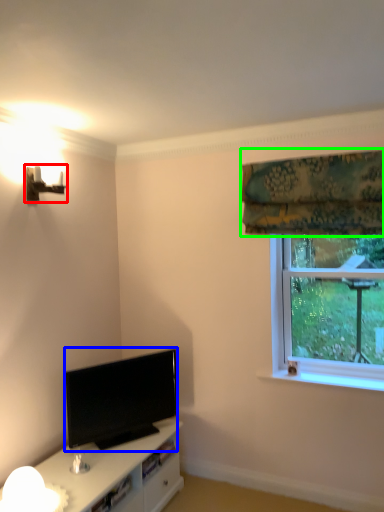
Question: Which object is positioned closest to table lamp (highlighted by a red box)? Select from television (highlighted by a blue box) and curtain (highlighted by a green box).

Choices:
 (A) television
 (B) curtain

Answer: (A)